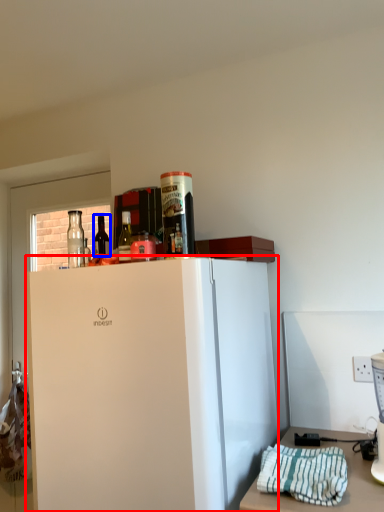
Question: Which object is closer to the camera taking this photo, refrigerator (highlighted by a red box) or bottle (highlighted by a blue box)?

Choices:
 (A) refrigerator
 (B) bottle

Answer: (A)